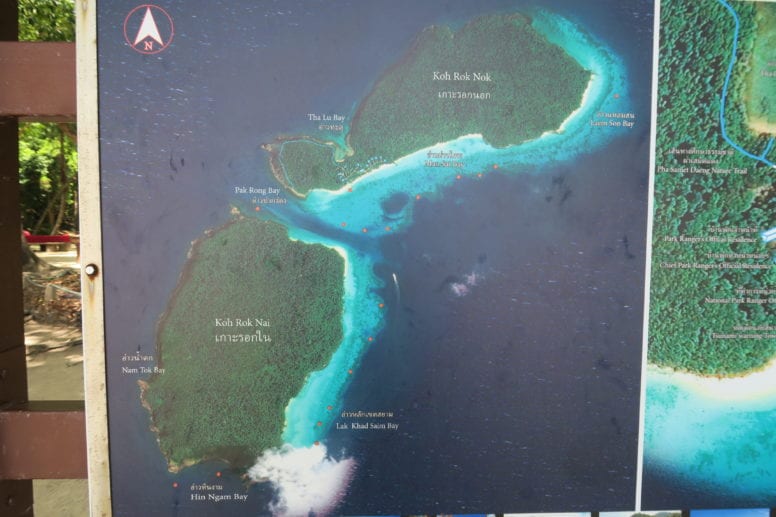
Where is `frame`? frame is located at coordinates (88, 197).